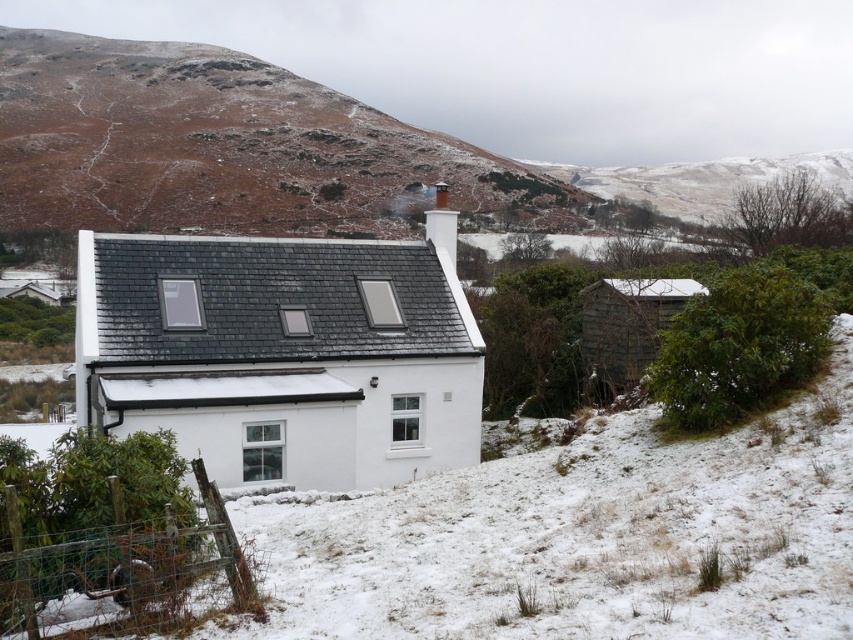
Question: Which point is closer to the camera?

Choices:
 (A) (357, 177)
 (B) (474, 417)
 (C) (595, 323)

Answer: (B)

Question: Considering the relative positions of brown textured rock at upper left and wooden shed at right in the image provided, where is brown textured rock at upper left located with respect to wooden shed at right?

Choices:
 (A) left
 (B) right

Answer: (A)

Question: Estimate the real-world distances between objects in this image. Which object is farther from the brown textured rock at upper left?

Choices:
 (A) white slate roof at center
 (B) wooden shed at right

Answer: (B)

Question: Among these objects, which one is nearest to the camera?

Choices:
 (A) wooden shed at right
 (B) brown textured rock at upper left
 (C) white slate roof at center

Answer: (C)

Question: Considering the relative positions of white slate roof at center and wooden shed at right in the image provided, where is white slate roof at center located with respect to wooden shed at right?

Choices:
 (A) above
 (B) below

Answer: (B)

Question: Can you confirm if white slate roof at center is wider than brown textured rock at upper left?

Choices:
 (A) yes
 (B) no

Answer: (B)